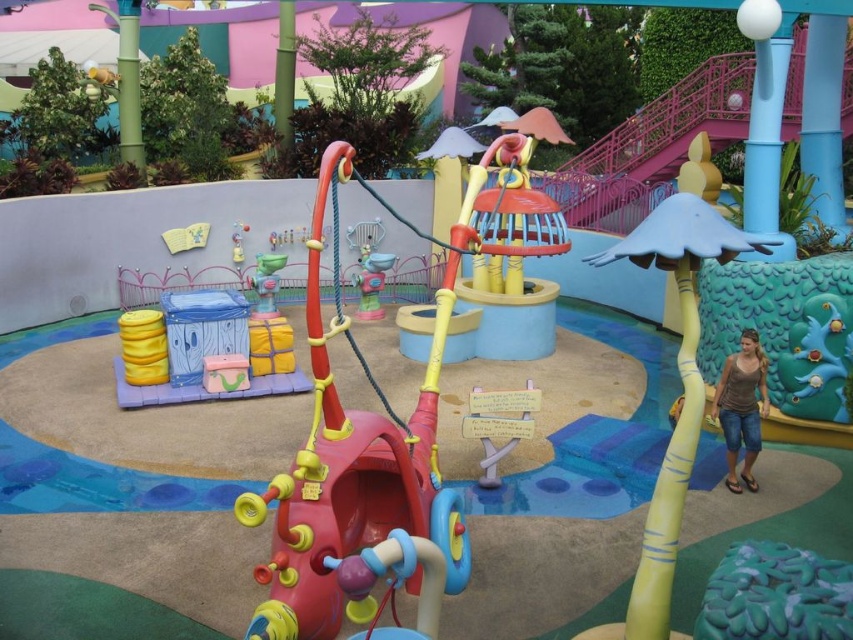
Describe the element at coordinates (680, 397) in the screenshot. The height and width of the screenshot is (640, 853). I see `yellow rubber mushroom at right` at that location.

Does point (653, 512) come in front of point (369, 316)?

Yes, it is in front of point (369, 316).

At what (x,y) coordinates should I click in order to perform the action: click on yellow rubber mushroom at right. Please return your answer as a coordinate pair (x, y). The height and width of the screenshot is (640, 853). Looking at the image, I should click on (680, 397).

Can you confirm if matte plastic toy at center is thinner than matte yellow toy at center?

Incorrect, matte plastic toy at center's width is not less than matte yellow toy at center's.

Can you confirm if matte plastic toy at center is positioned above matte yellow toy at center?

Incorrect, matte plastic toy at center is not positioned above matte yellow toy at center.

Is point (379, 312) closer to viewer compared to point (233, 244)?

Yes, it is in front of point (233, 244).

At what (x,y) coordinates should I click in order to perform the action: click on matte plastic toy at center. Please return your answer as a coordinate pair (x, y). This screenshot has height=640, width=853. Looking at the image, I should click on (370, 284).

Between rubberized plastic swing at center and denim shorts at lower right, which one has less height?

Standing shorter between the two is denim shorts at lower right.

Which of these two, rubberized plastic swing at center or denim shorts at lower right, stands taller?

rubberized plastic swing at center is taller.

Who is more forward, (294,557) or (730,394)?

Positioned in front is point (294,557).

I want to click on rubberized plastic swing at center, so click(x=352, y=472).